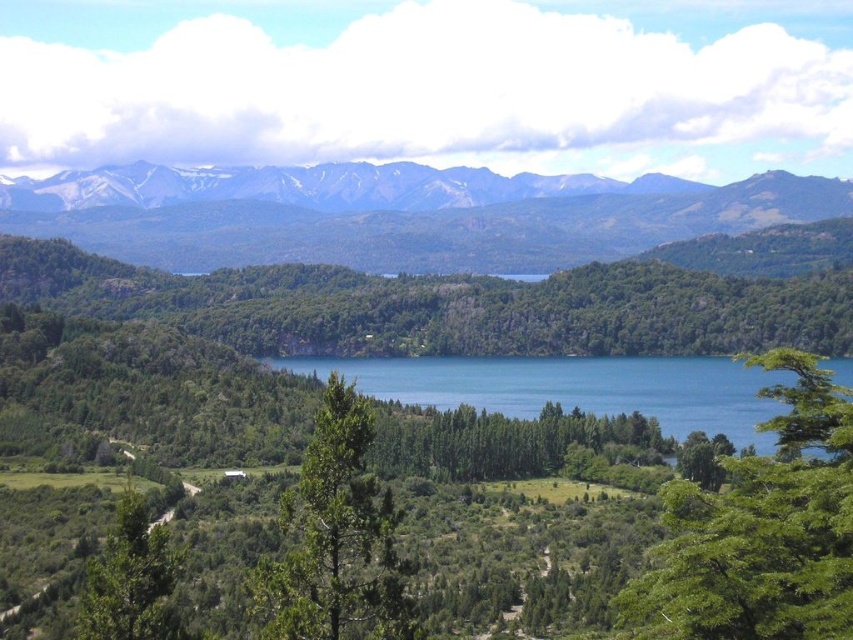
Question: Which object appears farthest from the camera in this image?

Choices:
 (A) green leafy tree at center
 (B) sandy brown mountains at upper center

Answer: (B)

Question: Is green leafy tree at center below green leafy tree at right?

Choices:
 (A) yes
 (B) no

Answer: (B)

Question: Which object appears closest to the camera in this image?

Choices:
 (A) green leafy tree at lower left
 (B) blue water at center

Answer: (B)

Question: Which point is farther to the camera?

Choices:
 (A) sandy brown mountains at upper center
 (B) green leafy tree at right

Answer: (A)

Question: Is the position of green leafy tree at right less distant than that of green matte tree at center?

Choices:
 (A) yes
 (B) no

Answer: (A)

Question: Is green leafy tree at center smaller than green matte tree at center?

Choices:
 (A) yes
 (B) no

Answer: (B)